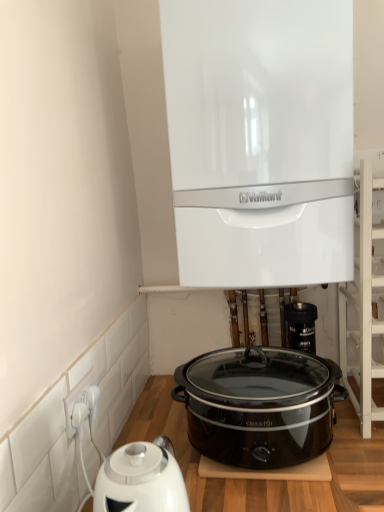
This screenshot has height=512, width=384. In order to click on white wooden shelf at upper right in this screenshot , I will do `click(364, 301)`.

In order to face black glossy slow cooker at center, should I rotate leftwards or rightwards?

To face it directly, rotate right by 9.042 degrees.

Describe the element at coordinates (260, 140) in the screenshot. This screenshot has height=512, width=384. I see `white glossy boiler at upper center` at that location.

This screenshot has width=384, height=512. Find the location of `black plastic table at lower center`. black plastic table at lower center is located at coordinates (x=264, y=480).

Locate an element on the screen. black plastic valve at lower center is located at coordinates (301, 326).

Locate an element on the screen. The width and height of the screenshot is (384, 512). slow cooker below the white glossy boiler at upper center (from a real-world perspective) is located at coordinates (259, 405).

Based on the photo, could you tell me if black glossy slow cooker at center is turned towards white glossy boiler at upper center?

No, black glossy slow cooker at center is not turned towards white glossy boiler at upper center.

Does black glossy slow cooker at center appear on the left side of white glossy boiler at upper center?

Indeed, black glossy slow cooker at center is positioned on the left side of white glossy boiler at upper center.

From the image's perspective, which object appears higher, black glossy slow cooker at center or white glossy boiler at upper center?

From the image's view, white glossy boiler at upper center is above.

From a real-world perspective, does black plastic table at lower center sit lower than white glossy boiler at upper center?

Yes, from a real-world perspective, black plastic table at lower center is below white glossy boiler at upper center.

Is white glossy boiler at upper center surrounded by black plastic table at lower center?

No, black plastic table at lower center does not contain white glossy boiler at upper center.

From the image's perspective, is black plastic table at lower center below white glossy boiler at upper center?

Indeed, from the image's perspective, black plastic table at lower center is shown beneath white glossy boiler at upper center.

Between white glossy boiler at upper center and white plastic socket at lower left, which one is positioned behind?

white glossy boiler at upper center.

Is white glossy boiler at upper center outside of white plastic socket at lower left?

Yes.

Considering the sizes of white glossy boiler at upper center and white plastic socket at lower left in the image, is white glossy boiler at upper center taller or shorter than white plastic socket at lower left?

Considering their sizes, white glossy boiler at upper center has more height than white plastic socket at lower left.

Is black plastic valve at lower center far from black glossy slow cooker at center?

black plastic valve at lower center is actually quite close to black glossy slow cooker at center.

Is black plastic valve at lower center inside or outside of black glossy slow cooker at center?

The correct answer is: outside.

From a real-world perspective, is black plastic valve at lower center beneath black glossy slow cooker at center?

Actually, black plastic valve at lower center is physically above black glossy slow cooker at center in the real world.

Is black plastic valve at lower center smaller than black glossy slow cooker at center?

Yes, black plastic valve at lower center is smaller than black glossy slow cooker at center.

From the image's perspective, relative to white glossy boiler at upper center, is white wooden shelf at upper right above or below?

white wooden shelf at upper right is below white glossy boiler at upper center.

Considering the positions of objects white wooden shelf at upper right and white glossy boiler at upper center in the image provided, who is in front, white wooden shelf at upper right or white glossy boiler at upper center?

white glossy boiler at upper center.

Is white wooden shelf at upper right oriented away from white glossy boiler at upper center?

No, white glossy boiler at upper center is not at the back of white wooden shelf at upper right.

Is point (360, 205) positioned before point (226, 116)?

That is True.

From the image's perspective, which object appears higher, black plastic valve at lower center or white wooden shelf at upper right?

white wooden shelf at upper right.

Which is closer, (289, 309) or (358, 370)?

The point (358, 370) is in front.

Is black plastic valve at lower center next to white wooden shelf at upper right and touching it?

There is a gap between black plastic valve at lower center and white wooden shelf at upper right.

Is black plastic valve at lower center oriented towards white wooden shelf at upper right?

No, black plastic valve at lower center is not oriented towards white wooden shelf at upper right.

What's the angular difference between white plastic socket at lower left and black glossy slow cooker at center's facing directions?

There is a 90-degree angle between the facing directions of white plastic socket at lower left and black glossy slow cooker at center.

Is white plastic socket at lower left oriented towards black glossy slow cooker at center?

Yes, white plastic socket at lower left is oriented towards black glossy slow cooker at center.

Is white plastic socket at lower left not within black glossy slow cooker at center?

Yes, white plastic socket at lower left is not within black glossy slow cooker at center.

Is white plastic socket at lower left in contact with black glossy slow cooker at center?

No, white plastic socket at lower left is not with black glossy slow cooker at center.

I want to click on slow cooker that is on the left side of white glossy boiler at upper center, so click(259, 405).

This screenshot has height=512, width=384. I want to click on table located underneath the white glossy boiler at upper center (from a real-world perspective), so click(264, 480).

Considering their positions, is black plastic valve at lower center positioned further to white glossy boiler at upper center than white plastic socket at lower left?

white plastic socket at lower left lies further to white glossy boiler at upper center than the other object.

Looking at the image, which one is located closer to white glossy boiler at upper center, black glossy slow cooker at center or white wooden shelf at upper right?

The object closer to white glossy boiler at upper center is white wooden shelf at upper right.

From the image, which object appears to be nearer to black glossy slow cooker at center, black plastic table at lower center or white wooden shelf at upper right?

Among the two, black plastic table at lower center is located nearer to black glossy slow cooker at center.

Which object lies nearer to the anchor point white plastic socket at lower left, white wooden shelf at upper right or black glossy slow cooker at center?

Among the two, black glossy slow cooker at center is located nearer to white plastic socket at lower left.

From the image, which object appears to be farther from black plastic table at lower center, white wooden shelf at upper right or black glossy slow cooker at center?

white wooden shelf at upper right.

Estimate the real-world distances between objects in this image. Which object is closer to white glossy boiler at upper center, white wooden shelf at upper right or black plastic valve at lower center?

white wooden shelf at upper right lies closer to white glossy boiler at upper center than the other object.

When comparing their distances from black plastic table at lower center, does white glossy boiler at upper center or white wooden shelf at upper right seem further?

white glossy boiler at upper center.

Estimate the real-world distances between objects in this image. Which object is further from white wooden shelf at upper right, black plastic table at lower center or white glossy boiler at upper center?

Based on the image, black plastic table at lower center appears to be further to white wooden shelf at upper right.

The height and width of the screenshot is (512, 384). I want to click on table situated between white plastic socket at lower left and white wooden shelf at upper right from left to right, so click(264, 480).

Where is `appliance that lies between white glossy boiler at upper center and black glossy slow cooker at center from top to bottom`? The height and width of the screenshot is (512, 384). appliance that lies between white glossy boiler at upper center and black glossy slow cooker at center from top to bottom is located at coordinates (301, 326).

Identify the location of shelf that lies between white glossy boiler at upper center and black plastic valve at lower center from top to bottom. (364, 301).

You are a GUI agent. You are given a task and a screenshot of the screen. Output one action in this format:
    pyautogui.click(x=<x>, y=<y>)
    Task: Click on the appliance between white wooden shelf at upper right and black plastic table at lower center in the up-down direction
    
    Given the screenshot: What is the action you would take?
    pyautogui.click(x=301, y=326)